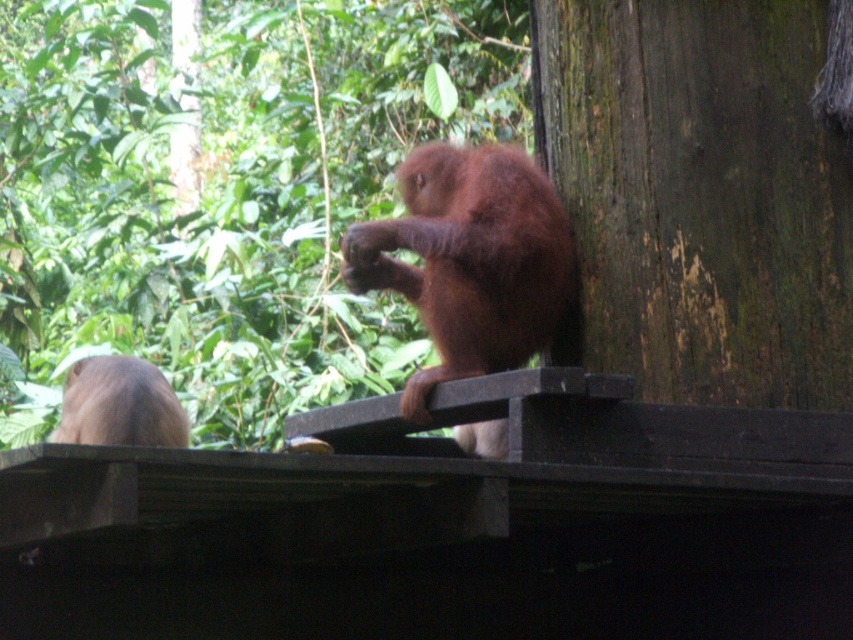
Question: Does smooth brown tree trunk at upper right lie in front of dark brown wood at right?

Choices:
 (A) yes
 (B) no

Answer: (B)

Question: Which of these objects is positioned closest to the dark brown wood at right?

Choices:
 (A) brown fur monkey at left
 (B) smooth brown tree trunk at upper right

Answer: (A)

Question: Which point is closer to the camera?

Choices:
 (A) brown furry monkey at center
 (B) smooth brown tree trunk at upper right

Answer: (A)

Question: Can you confirm if dark brown wood at right is positioned below brown fur monkey at left?

Choices:
 (A) no
 (B) yes

Answer: (A)

Question: Which point is closer to the camera?

Choices:
 (A) [86, 435]
 (B) [514, 150]

Answer: (A)

Question: Is smooth brown tree trunk at upper right to the left of dark brown wood at right from the viewer's perspective?

Choices:
 (A) yes
 (B) no

Answer: (A)